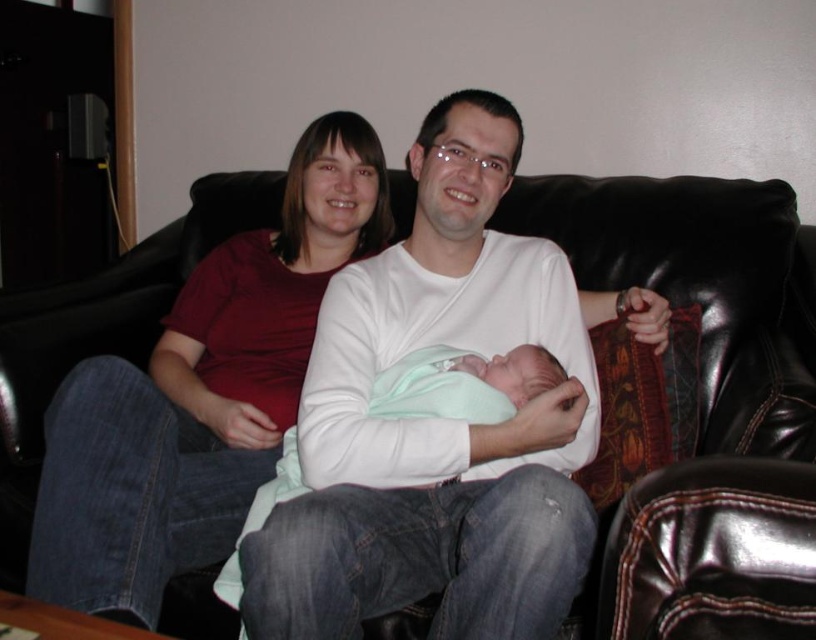
Is black leather couch at center smaller than light green swaddled newborn at center?

No, black leather couch at center is not smaller than light green swaddled newborn at center.

Is the position of black leather couch at center less distant than that of light green swaddled newborn at center?

Yes, it is.

Does point (402, 618) come behind point (393, 387)?

That is False.

Find the location of a particular element. This screenshot has height=640, width=816. black leather couch at center is located at coordinates (686, 321).

Can you confirm if matte red shirt at upper left is positioned to the right of light green swaddled newborn at center?

Incorrect, matte red shirt at upper left is not on the right side of light green swaddled newborn at center.

Who is lower down, matte red shirt at upper left or light green swaddled newborn at center?

light green swaddled newborn at center is lower down.

I want to click on matte red shirt at upper left, so click(x=202, y=394).

Which of these two, white cotton shirt at center or matte red shirt at upper left, stands taller?

Standing taller between the two is matte red shirt at upper left.

Can you confirm if white cotton shirt at center is positioned above matte red shirt at upper left?

Incorrect, white cotton shirt at center is not positioned above matte red shirt at upper left.

Find the location of `white cotton shirt at center`. white cotton shirt at center is located at coordinates (438, 422).